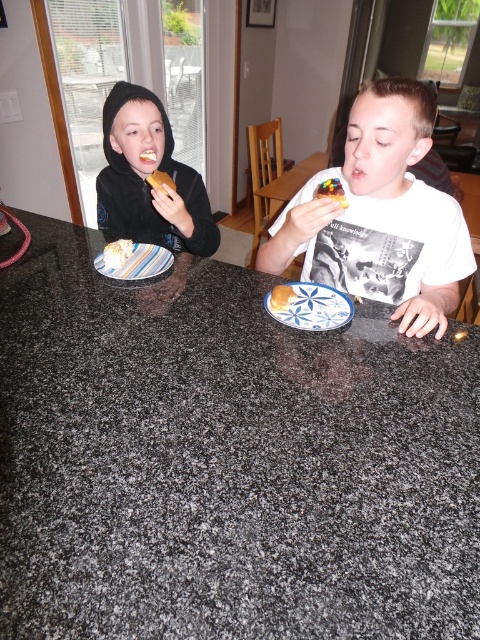
Does point (120, 278) lie in front of point (160, 172)?

Yes, point (120, 278) is in front of point (160, 172).

The height and width of the screenshot is (640, 480). In order to click on striped paper plate at center in this screenshot , I will do `click(137, 262)`.

Locate an element on the screen. This screenshot has height=640, width=480. striped paper plate at center is located at coordinates (137, 262).

Who is positioned more to the left, striped paper plate at center or yellow cake at center?

striped paper plate at center is more to the left.

Describe the element at coordinates (137, 262) in the screenshot. I see `striped paper plate at center` at that location.

Identify the location of striped paper plate at center. The image size is (480, 640). (137, 262).

Does white matte t-shirt at center have a lesser height compared to white cake at left?

No.

Who is more distant from viewer, (369, 244) or (129, 252)?

Positioned behind is point (129, 252).

Between point (410, 129) and point (110, 264), which one is positioned behind?

The point (110, 264) is behind.

Where is `white matte t-shirt at center`? white matte t-shirt at center is located at coordinates (381, 216).